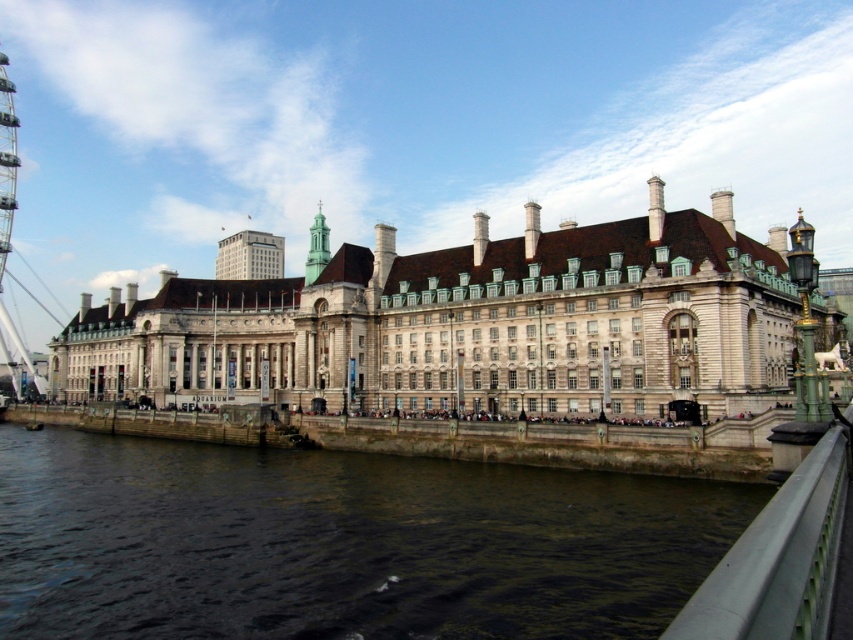
Question: Which object appears farthest from the camera in this image?

Choices:
 (A) white stone building at center
 (B) green stone tower at center

Answer: (B)

Question: Is the position of white stone building at center more distant than that of metallic ferris wheel at left?

Choices:
 (A) no
 (B) yes

Answer: (A)

Question: Which object is positioned closest to the green metallic railing at lower right?

Choices:
 (A) green stone tower at center
 (B) white stone building at center
 (C) metallic ferris wheel at left

Answer: (B)

Question: Which of the following is the farthest from the observer?

Choices:
 (A) (705, 608)
 (B) (463, 552)
 (C) (13, 106)
 (D) (323, 240)

Answer: (C)

Question: Is green metallic railing at lower right wider than green stone tower at center?

Choices:
 (A) yes
 (B) no

Answer: (A)

Question: Is green metallic railing at lower right wider than green stone tower at center?

Choices:
 (A) no
 (B) yes

Answer: (B)